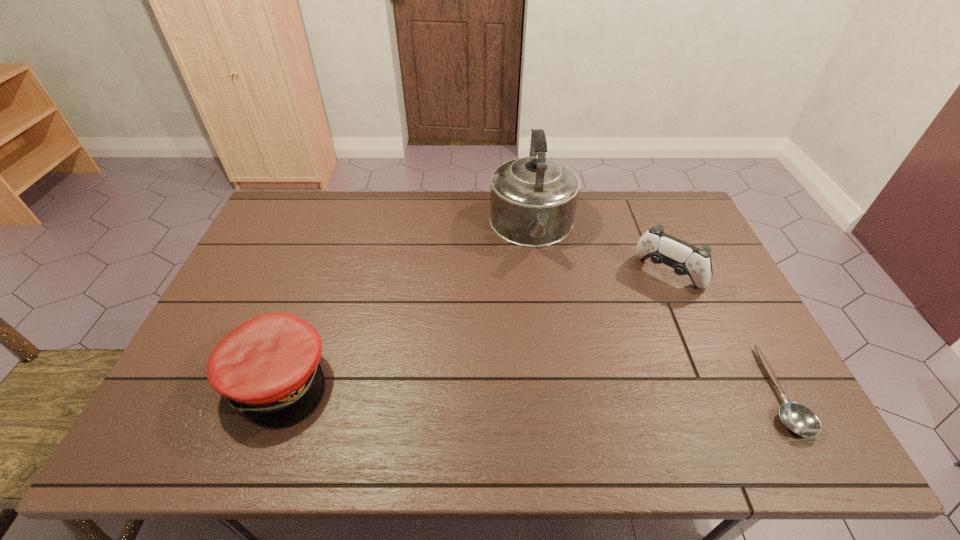
This screenshot has width=960, height=540. I want to click on free spot on the desktop that is between the cap and the shortest object and is positioned on the front-facing side of the third shortest object, so click(x=577, y=387).

I want to click on vacant space on the desktop that is between the third tallest object and the rightmost object and is positioned with the spout at the front of the tallest object, so click(x=556, y=386).